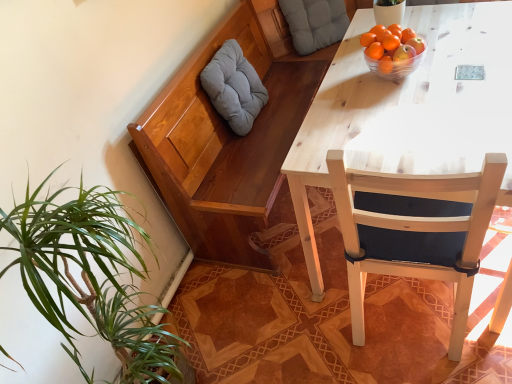
Question: Is gray fabric pillow at upper left, which is the second pillow in right-to-left order, completely or partially outside of orange matte at upper right?

Choices:
 (A) no
 (B) yes

Answer: (B)

Question: Is orange matte at upper right located within gray fabric pillow at upper left, positioned as the 2th pillow in top-to-bottom order?

Choices:
 (A) no
 (B) yes

Answer: (A)

Question: From the image's perspective, does gray fabric pillow at upper left, arranged as the 1th pillow when ordered from the bottom, appear lower than orange matte at upper right?

Choices:
 (A) yes
 (B) no

Answer: (B)

Question: Is gray fabric pillow at upper left, which is the second pillow in right-to-left order, aimed at orange matte at upper right?

Choices:
 (A) no
 (B) yes

Answer: (B)

Question: Considering the relative sizes of gray fabric pillow at upper left, positioned as the 2th pillow in top-to-bottom order, and orange matte at upper right in the image provided, is gray fabric pillow at upper left, positioned as the 2th pillow in top-to-bottom order, shorter than orange matte at upper right?

Choices:
 (A) yes
 (B) no

Answer: (B)

Question: In terms of width, does transparent glass bowl at upper right look wider or thinner when compared to orange matte tangerine at upper right?

Choices:
 (A) thin
 (B) wide

Answer: (B)

Question: Is transparent glass bowl at upper right taller or shorter than orange matte tangerine at upper right?

Choices:
 (A) short
 (B) tall

Answer: (B)

Question: Considering the positions of point (376, 71) and point (387, 46), is point (376, 71) closer or farther from the camera than point (387, 46)?

Choices:
 (A) closer
 (B) farther

Answer: (B)

Question: From a real-world perspective, relative to orange matte tangerine at upper right, is transparent glass bowl at upper right vertically above or below?

Choices:
 (A) above
 (B) below

Answer: (B)

Question: Is wooden chair at right in front of or behind transparent glass bowl at upper right in the image?

Choices:
 (A) front
 (B) behind

Answer: (A)

Question: Is wooden chair at right to the left or to the right of transparent glass bowl at upper right in the image?

Choices:
 (A) right
 (B) left

Answer: (A)

Question: Do you think wooden chair at right is within transparent glass bowl at upper right, or outside of it?

Choices:
 (A) outside
 (B) inside

Answer: (A)

Question: In terms of height, does wooden chair at right look taller or shorter compared to transparent glass bowl at upper right?

Choices:
 (A) tall
 (B) short

Answer: (A)

Question: Considering the relative positions of orange matte at upper right and transparent glass bowl at upper right in the image provided, is orange matte at upper right to the left or to the right of transparent glass bowl at upper right?

Choices:
 (A) right
 (B) left

Answer: (B)

Question: From a real-world perspective, relative to transparent glass bowl at upper right, is orange matte at upper right vertically above or below?

Choices:
 (A) above
 (B) below

Answer: (A)